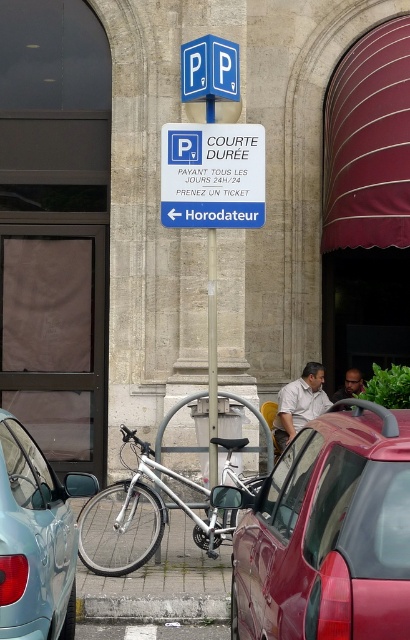
Is point (236, 593) in front of point (63, 556)?

No, it is not.

Which of these two, metallic red car at center or light blue matte car at lower left, stands taller?

With more height is metallic red car at center.

Describe the element at coordinates (330, 532) in the screenshot. I see `metallic red car at center` at that location.

Where is `metallic red car at center`? This screenshot has height=640, width=410. metallic red car at center is located at coordinates (x=330, y=532).

Who is more forward, [86,560] or [195,616]?

Point [195,616] is more forward.

Looking at this image, can you confirm if silver metallic bicycle at center is positioned below gray concrete curb at lower center?

No, silver metallic bicycle at center is not below gray concrete curb at lower center.

This screenshot has width=410, height=640. Describe the element at coordinates (136, 512) in the screenshot. I see `silver metallic bicycle at center` at that location.

Locate an element on the screen. The image size is (410, 640). silver metallic bicycle at center is located at coordinates (136, 512).

Who is more forward, [9,413] or [163,198]?

Point [9,413] is in front.

Image resolution: width=410 pixels, height=640 pixels. In order to click on light blue matte car at lower left in this screenshot , I will do `click(36, 538)`.